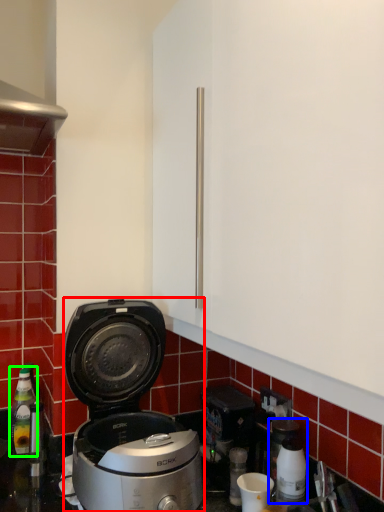
Question: Based on their relative distances, which object is farther from kitchen appliance (highlighted by a red box)? Choose from coffee machine (highlighted by a blue box) and bottle (highlighted by a green box).

Choices:
 (A) coffee machine
 (B) bottle

Answer: (B)